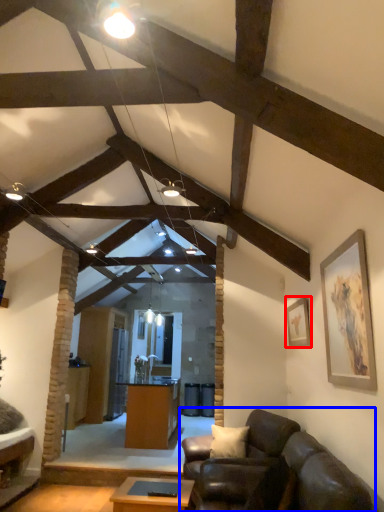
Question: Which of the following is the farthest to the observer, picture frame (highlighted by a red box) or studio couch (highlighted by a blue box)?

Choices:
 (A) picture frame
 (B) studio couch

Answer: (A)